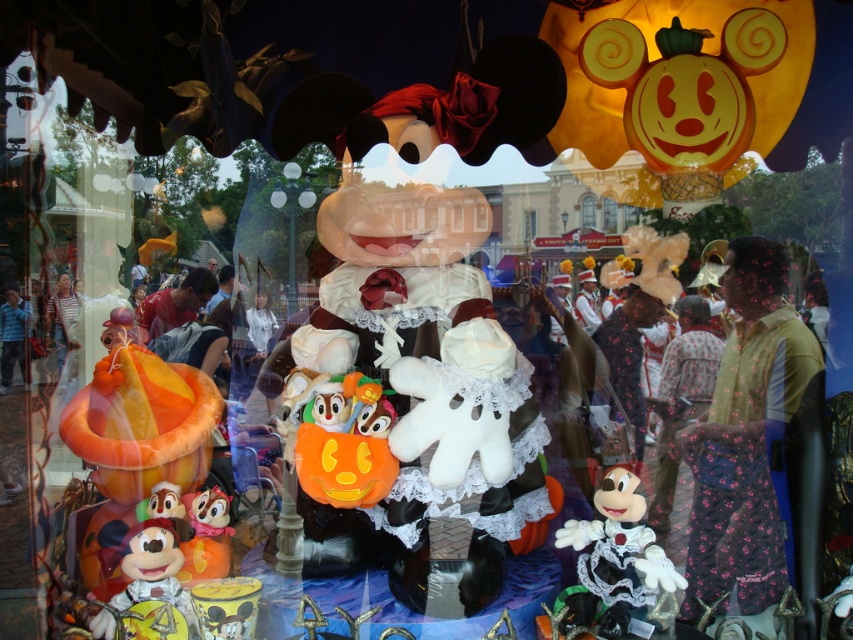
Question: Observing the image, what is the correct spatial positioning of white plush toy at center in reference to matte yellow plush toy at lower left?

Choices:
 (A) right
 (B) left

Answer: (A)

Question: Based on their relative distances, which object is nearer to the matte yellow plush toy at lower left?

Choices:
 (A) matte orange plush toy at lower left
 (B) white plush toy at center

Answer: (A)

Question: Among these objects, which one is nearest to the camera?

Choices:
 (A) matte yellow plush toy at lower left
 (B) matte orange plush toy at lower left

Answer: (A)

Question: Which is nearer to the matte orange plush toy at lower left?

Choices:
 (A) white plush toy at center
 (B) matte yellow plush toy at lower left

Answer: (B)

Question: Is white plush toy at center below matte orange plush toy at lower left?

Choices:
 (A) no
 (B) yes

Answer: (B)

Question: Is matte yellow plush toy at lower left positioned in front of matte orange plush toy at lower left?

Choices:
 (A) yes
 (B) no

Answer: (A)